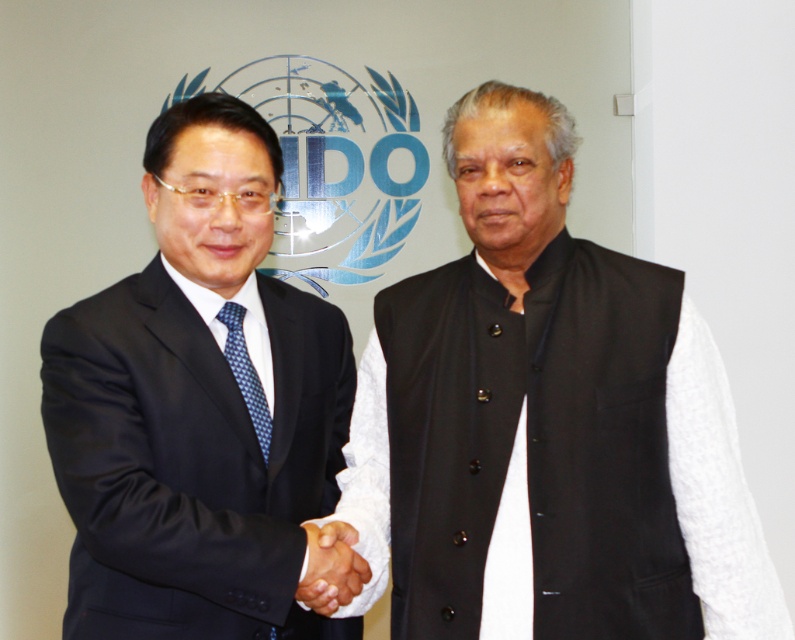
Question: Which point is farther from the camera taking this photo?

Choices:
 (A) (305, 531)
 (B) (256, 124)
 (C) (666, 611)
 (D) (237, 317)

Answer: (D)

Question: Does black cotton vest at center appear on the right side of matte black suit at left?

Choices:
 (A) yes
 (B) no

Answer: (A)

Question: Based on their relative distances, which object is farther from the matte black suit at left?

Choices:
 (A) black matte hand at center
 (B) black cotton vest at center

Answer: (B)

Question: Which point appears farthest from the camera in this image?

Choices:
 (A) (363, 570)
 (B) (258, 445)

Answer: (B)

Question: Is black cotton vest at center to the right of matte black suit at left from the viewer's perspective?

Choices:
 (A) yes
 (B) no

Answer: (A)

Question: Can you confirm if matte black suit at left is wider than black matte hand at center?

Choices:
 (A) yes
 (B) no

Answer: (A)